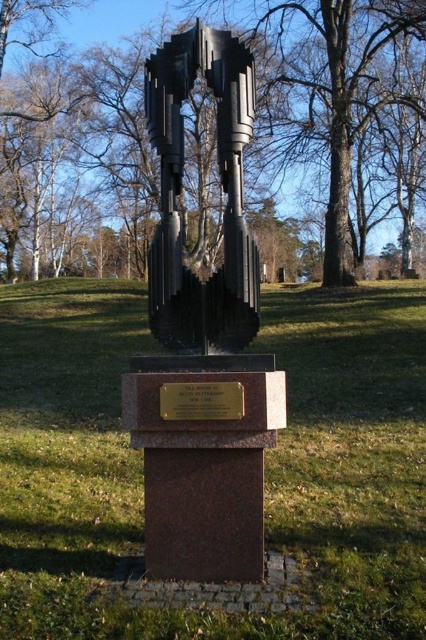
You are an art student standing in front of the sculpture. You want to take a photo of the polished bronze sculpture at center and the black polished metal sculpture at center. Which one will appear larger in your photo?

The polished bronze sculpture at center will appear larger in your photo because it is closer to you than the black polished metal sculpture at center.

You are standing in the park and want to take a photo of the black metal tree at center. If your camera has a zoom lens set to 50mm focal length, which is the best position to capture the entire sculpture in the frame? Assume the camera sensor size is 36mm x 24mm and the sculpture is 2 meters tall. The distance from the camera to the sculpture should be calculated using the formula distance_in_meters equals sensor_height divided by tan_half_viewing_angle. The half viewing angle can be calculated using the 5

The black metal tree at center is located at coordinates point (336, 104). To capture the entire sculpture in the frame, you need to position the camera at a distance calculated using the sensor height and the focal length. However, the exact distance requires knowing the sensor height and applying the formula provided. Since the sculpture is 2 meters tall, the calculation would involve determining the half viewing angle first using the focal length and sensor dimensions. Once that is done, the distance_m